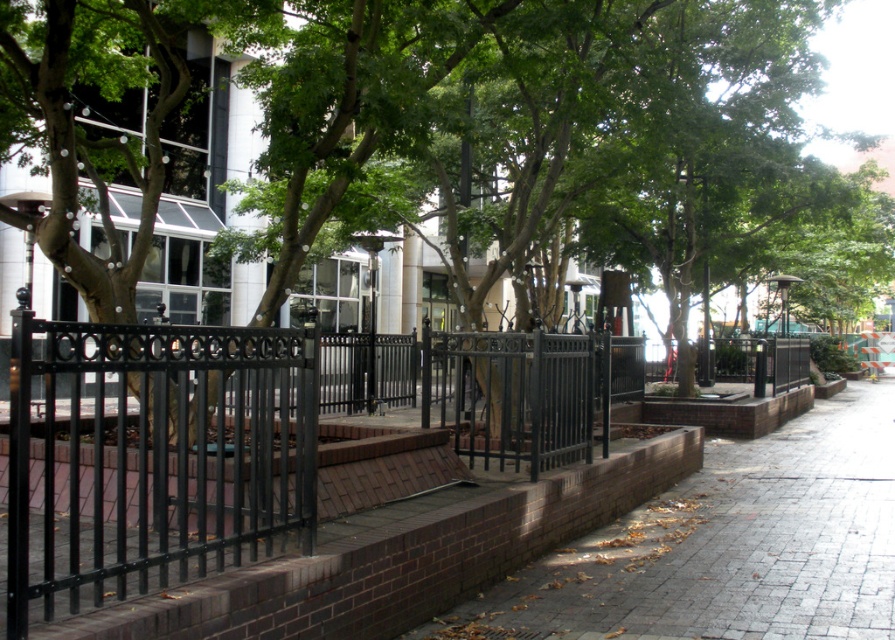
Question: Based on their relative distances, which object is nearer to the black wrought iron fence at center?

Choices:
 (A) black wrought iron fence at left
 (B) brick pavement at center
 (C) green leafy tree at center

Answer: (A)

Question: Can you confirm if green leafy tree at center is positioned to the left of black wrought iron fence at center?

Choices:
 (A) yes
 (B) no

Answer: (B)

Question: Does black wrought iron fence at center have a greater width compared to brick pavement at center?

Choices:
 (A) no
 (B) yes

Answer: (A)

Question: Based on their relative distances, which object is nearer to the green leafy tree at center?

Choices:
 (A) black wrought iron fence at center
 (B) brick pavement at center
 (C) black wrought iron fence at left

Answer: (B)

Question: From the image, what is the correct spatial relationship of black wrought iron fence at left in relation to brick pavement at center?

Choices:
 (A) below
 (B) above

Answer: (B)

Question: Considering the real-world distances, which object is closest to the black wrought iron fence at left?

Choices:
 (A) black wrought iron fence at center
 (B) green leafy tree at center
 (C) brick pavement at center

Answer: (A)